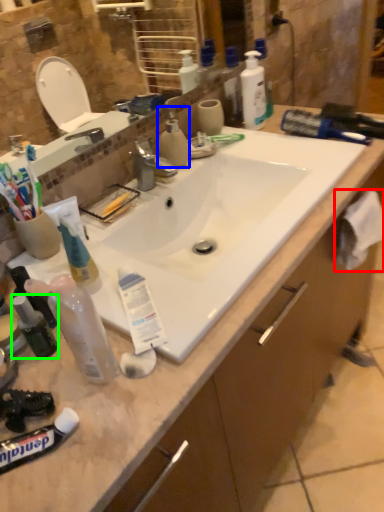
Question: Considering the real-world distances, which object is closest to toilet paper (highlighted by a red box)? cleaning product (highlighted by a blue box) or mouthwash (highlighted by a green box).

Choices:
 (A) cleaning product
 (B) mouthwash

Answer: (A)